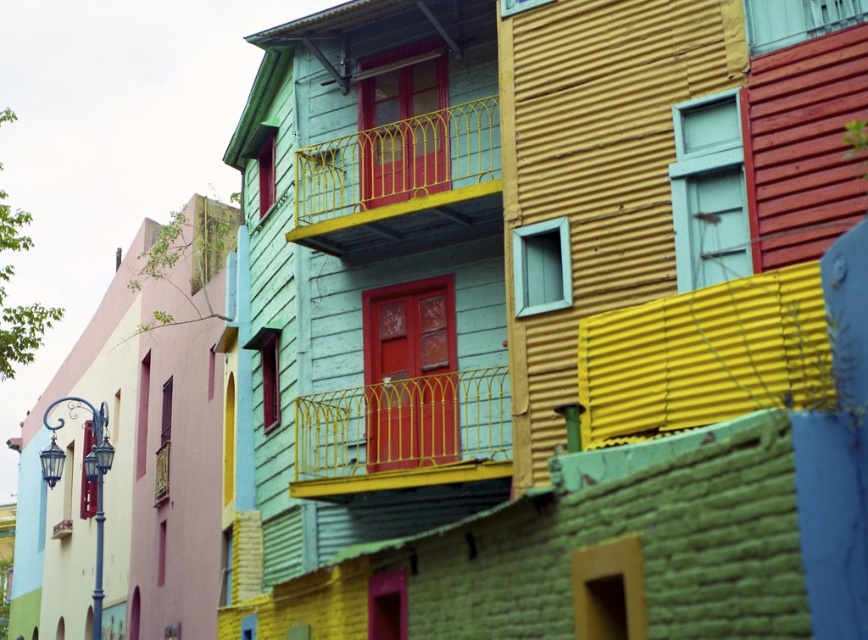
Can you confirm if yellow corrugated metal at center is taller than yellow metal/railings at center?

Indeed, yellow corrugated metal at center has a greater height compared to yellow metal/railings at center.

Describe the element at coordinates (704, 356) in the screenshot. The width and height of the screenshot is (868, 640). I see `yellow corrugated metal at center` at that location.

Does point (720, 332) come closer to viewer compared to point (398, 244)?

Yes, it is in front of point (398, 244).

Locate an element on the screen. yellow corrugated metal at center is located at coordinates (704, 356).

Who is taller, yellow corrugated metal at center or yellow metal railing at center?

Standing taller between the two is yellow corrugated metal at center.

Can you confirm if yellow corrugated metal at center is shorter than yellow metal railing at center?

No.

Is point (621, 384) farther from viewer compared to point (393, 404)?

That is False.

Where is `yellow corrugated metal at center`? yellow corrugated metal at center is located at coordinates (704, 356).

Looking at this image, is yellow metal/railings at center shorter than yellow metal railing at center?

Correct, yellow metal/railings at center is not as tall as yellow metal railing at center.

Who is shorter, yellow metal/railings at center or yellow metal railing at center?

Standing shorter between the two is yellow metal/railings at center.

Which is behind, point (383, 193) or point (464, 396)?

The point (383, 193) is behind.

Locate an element on the screen. The height and width of the screenshot is (640, 868). yellow metal/railings at center is located at coordinates (399, 180).